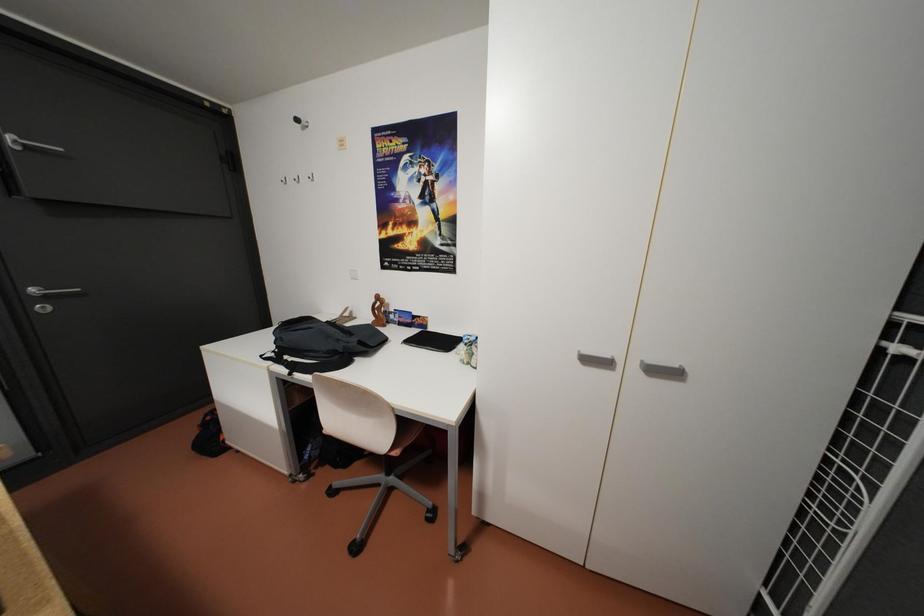
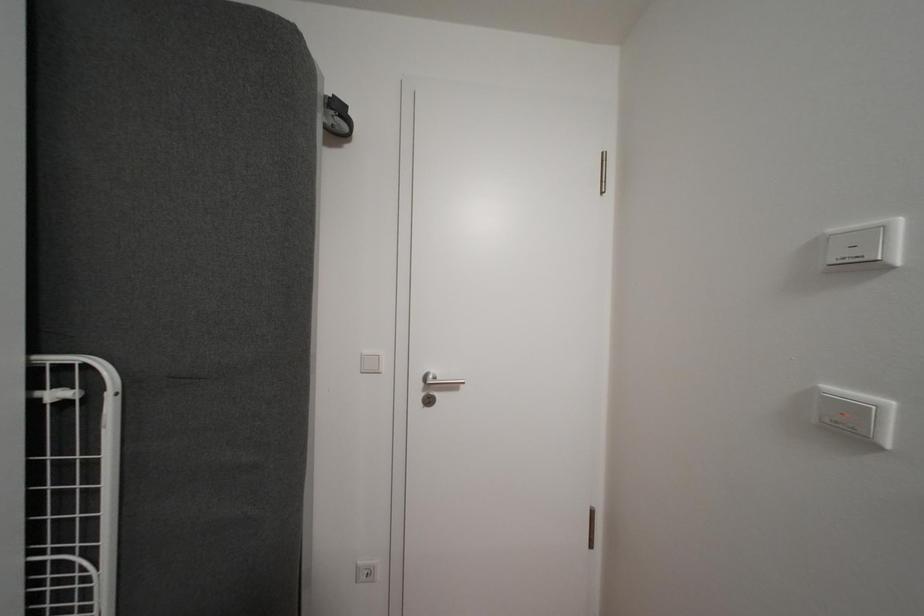
Question: The camera is either moving clockwise (left) or counter-clockwise (right) around the object. The first image is from the beginning of the video and the second image is from the end. Is the camera moving left or right when shooting the video?

Choices:
 (A) Left
 (B) Right

Answer: (A)